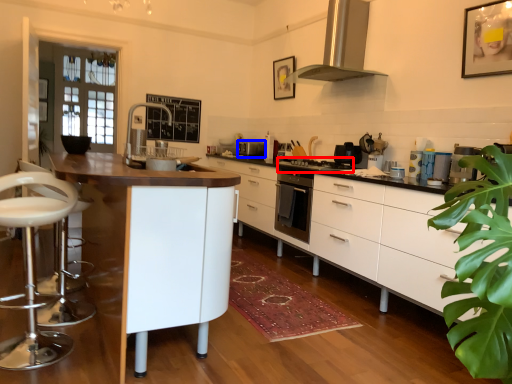
Question: Which of the following is the farthest to the observer, gas stove (highlighted by a red box) or appliance (highlighted by a blue box)?

Choices:
 (A) gas stove
 (B) appliance

Answer: (B)